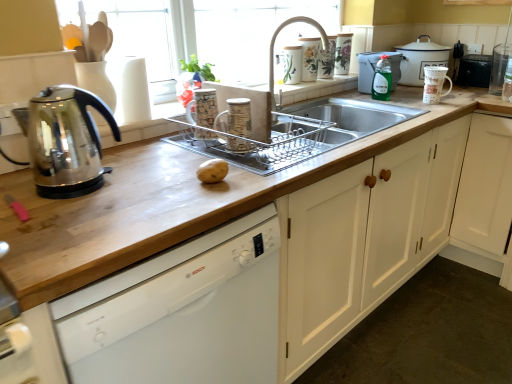
This screenshot has height=384, width=512. In order to click on vacant space to the right of green glass bottle at upper right in this screenshot , I will do (406, 89).